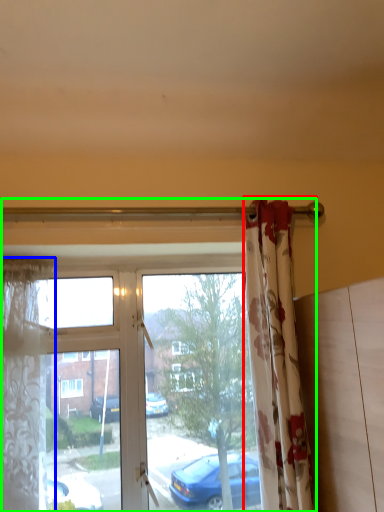
Question: Estimate the real-world distances between objects in this image. Which object is farther from curtain (highlighted by a red box), curtain (highlighted by a blue box) or window (highlighted by a green box)?

Choices:
 (A) curtain
 (B) window

Answer: (A)